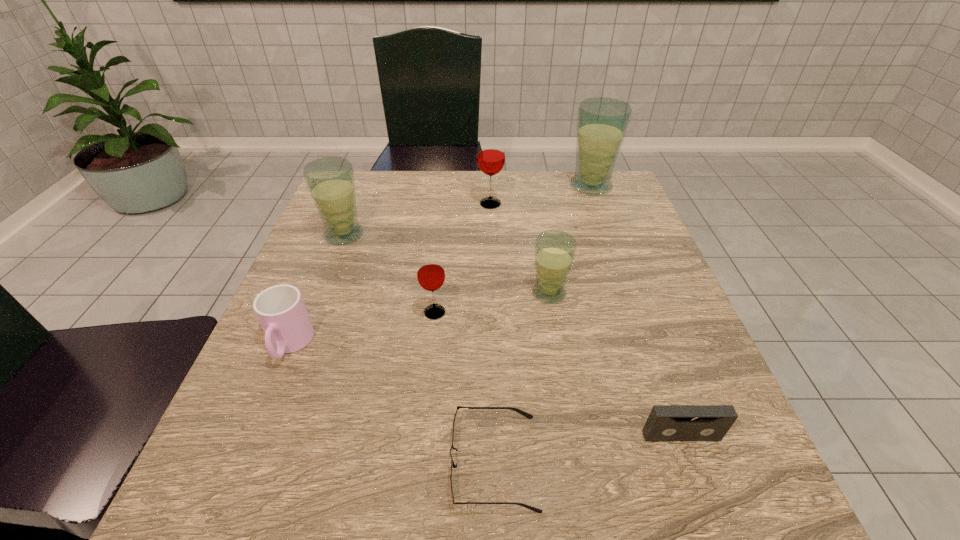
In the image, there is a desktop. Identify the location of free space at the far edge. (564, 184).

In the image, there is a desktop. Where is `vacant space at the near edge`? vacant space at the near edge is located at coordinates (393, 488).

The height and width of the screenshot is (540, 960). I want to click on vacant space at the left edge of the desktop, so click(342, 272).

Locate an element on the screen. The height and width of the screenshot is (540, 960). free space at the right edge is located at coordinates (709, 387).

Where is `blank space at the far right corner of the desktop`? blank space at the far right corner of the desktop is located at coordinates (580, 202).

Where is `vacant space at the near right corner of the desktop`? This screenshot has height=540, width=960. vacant space at the near right corner of the desktop is located at coordinates (713, 481).

Find the location of a particular element. free point between the second nearest blue glass and the farther red glass is located at coordinates (418, 219).

At what (x,y) coordinates should I click in order to perform the action: click on free spot between the second shortest object and the second smallest blue glass. Please return your answer as a coordinate pair (x, y). This screenshot has height=540, width=960. Looking at the image, I should click on (513, 335).

Where is `blank region between the smaller red glass and the seventh tallest object`? The height and width of the screenshot is (540, 960). blank region between the smaller red glass and the seventh tallest object is located at coordinates (558, 374).

The image size is (960, 540). I want to click on vacant area that lies between the second shortest object and the farther red glass, so click(586, 320).